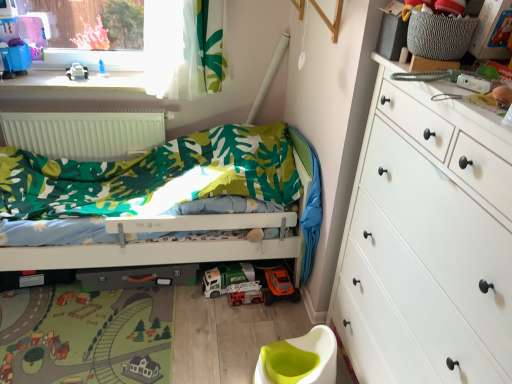
Locate an element on the screen. The width and height of the screenshot is (512, 384). free space above white matte radiator at upper left (from a real-world perspective) is located at coordinates (94, 109).